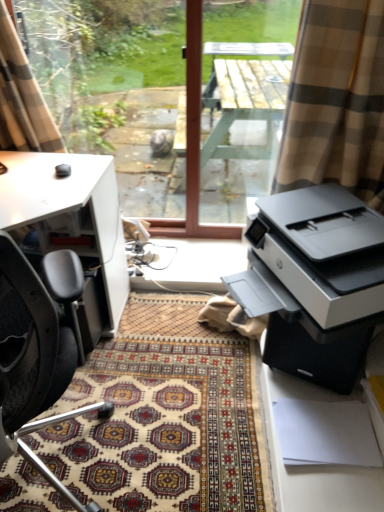
Question: Considering the relative sizes of wooden table at center and black leather chair at left in the image provided, is wooden table at center shorter than black leather chair at left?

Choices:
 (A) no
 (B) yes

Answer: (A)

Question: Does wooden table at center have a smaller size compared to black leather chair at left?

Choices:
 (A) no
 (B) yes

Answer: (B)

Question: From a real-world perspective, is wooden table at center located beneath black leather chair at left?

Choices:
 (A) yes
 (B) no

Answer: (B)

Question: From a real-world perspective, is wooden table at center positioned over black leather chair at left based on gravity?

Choices:
 (A) no
 (B) yes

Answer: (B)

Question: Considering the relative sizes of wooden table at center and black leather chair at left in the image provided, is wooden table at center bigger than black leather chair at left?

Choices:
 (A) yes
 (B) no

Answer: (B)

Question: From the image's perspective, is wooden table at center located above black leather chair at left?

Choices:
 (A) yes
 (B) no

Answer: (A)

Question: Considering the relative sizes of white matte desk at left and wooden table at center in the image provided, is white matte desk at left shorter than wooden table at center?

Choices:
 (A) no
 (B) yes

Answer: (B)

Question: Is white matte desk at left bigger than wooden table at center?

Choices:
 (A) no
 (B) yes

Answer: (B)

Question: Is white matte desk at left not inside wooden table at center?

Choices:
 (A) no
 (B) yes

Answer: (B)

Question: Is white matte desk at left next to wooden table at center?

Choices:
 (A) no
 (B) yes

Answer: (A)

Question: Is wooden table at center surrounded by white matte desk at left?

Choices:
 (A) yes
 (B) no

Answer: (B)

Question: Considering the relative sizes of white matte desk at left and wooden table at center in the image provided, is white matte desk at left smaller than wooden table at center?

Choices:
 (A) no
 (B) yes

Answer: (A)

Question: From the image's perspective, is matte black printer at right on top of wooden table at center?

Choices:
 (A) yes
 (B) no

Answer: (B)